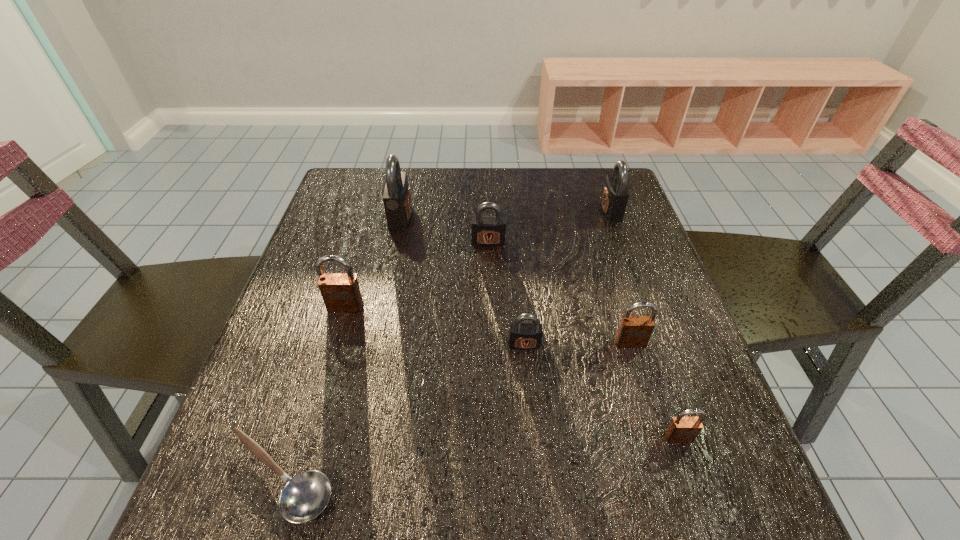
Locate an element on the screen. This screenshot has width=960, height=540. the nearest padlock is located at coordinates (681, 429).

The width and height of the screenshot is (960, 540). Find the location of `gray ladle`. gray ladle is located at coordinates (305, 496).

Image resolution: width=960 pixels, height=540 pixels. What are the coordinates of `the shortest object` in the screenshot? It's located at (x=305, y=496).

This screenshot has height=540, width=960. In order to click on vacant space located 0.210m on the front of the second padlock from left to right near the keyhole in this screenshot , I will do `click(489, 217)`.

Where is `free space located on the front of the rightmost gray padlock near the keyhole`? This screenshot has height=540, width=960. free space located on the front of the rightmost gray padlock near the keyhole is located at coordinates (568, 211).

This screenshot has height=540, width=960. Identify the location of vacant space situated on the front of the rightmost gray padlock near the keyhole. (457, 211).

I want to click on vacant area situated 0.110m on the front of the rightmost gray padlock near the keyhole, so click(562, 211).

Identify the location of vacant space situated on the front-facing side of the leftmost brown padlock. (308, 436).

Locate an element on the screen. The height and width of the screenshot is (540, 960). vacant space located on the front-facing side of the second nearest brown padlock is located at coordinates (641, 377).

This screenshot has width=960, height=540. Identify the location of vacant space located 0.270m on the front of the second nearest gray padlock near the keyhole. (491, 331).